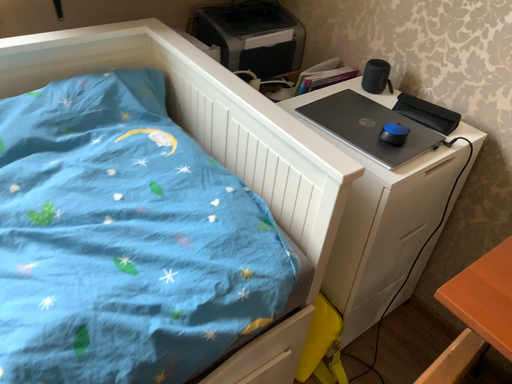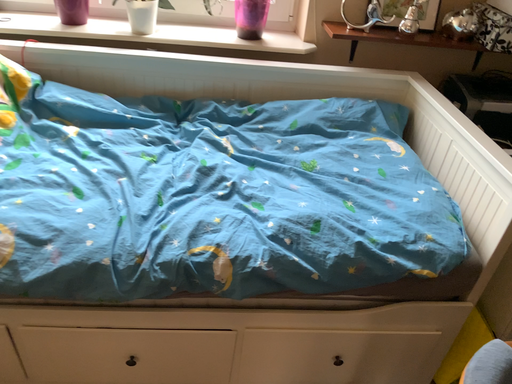
Question: Which way did the camera rotate in the video?

Choices:
 (A) rotated left
 (B) rotated right

Answer: (A)